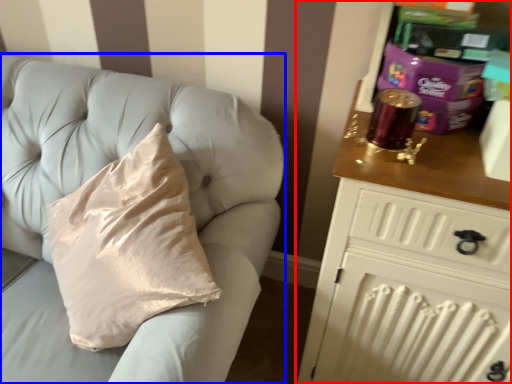
Question: Which object is further to the camera taking this photo, chest of drawers (highlighted by a red box) or furniture (highlighted by a blue box)?

Choices:
 (A) chest of drawers
 (B) furniture

Answer: (B)